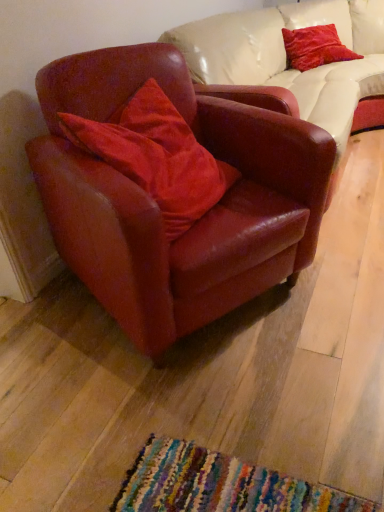
Question: Considering the relative positions of velvet red pillow at center, which is counted as the 2th pillow, starting from the back, and velvet red pillow at upper right, the 2th pillow from the left, in the image provided, is velvet red pillow at center, which is counted as the 2th pillow, starting from the back, to the left or to the right of velvet red pillow at upper right, the 2th pillow from the left,?

Choices:
 (A) right
 (B) left

Answer: (B)

Question: From the image's perspective, is velvet red pillow at center, which ranks as the 2th pillow in right-to-left order, above or below velvet red pillow at upper right, the 2th pillow from the left?

Choices:
 (A) above
 (B) below

Answer: (B)

Question: Which object is the farthest from the leather armchair at left?

Choices:
 (A) velvet red pillow at upper right, which ranks as the first pillow in right-to-left order
 (B) velvet red pillow at center, which ranks as the 2th pillow in right-to-left order

Answer: (A)

Question: Estimate the real-world distances between objects in this image. Which object is farther from the velvet red pillow at center, acting as the 2th pillow starting from the top?

Choices:
 (A) leather armchair at left
 (B) velvet red pillow at upper right, arranged as the 2th pillow when ordered from the bottom

Answer: (B)